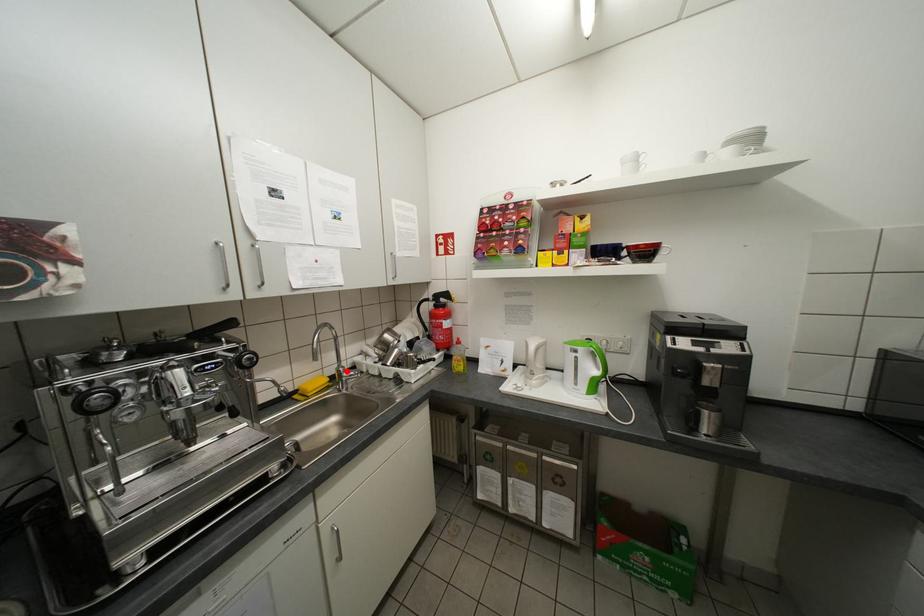
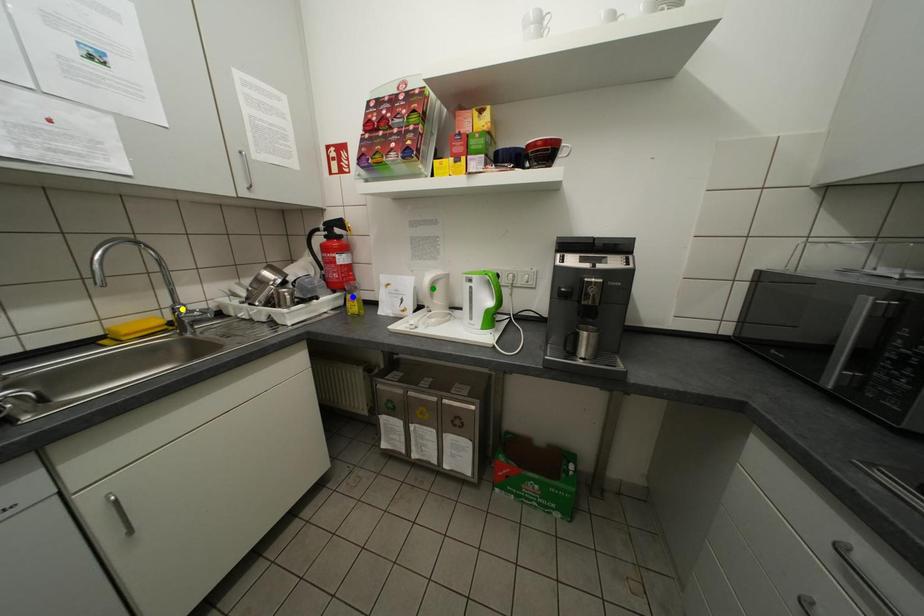
Question: I am providing you with two images of the same scene from different viewpoints. A red point is marked on the first image. You are given multiple points on the second image. Can you choose the point in image 2 that corresponds to the point in image 1?

Choices:
 (A) blue point
 (B) yellow point
 (C) green point

Answer: (B)